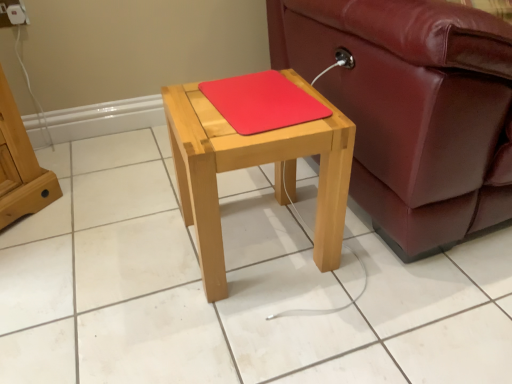
The width and height of the screenshot is (512, 384). Find the location of `unoccupied area in front of natural wood table at center`. unoccupied area in front of natural wood table at center is located at coordinates (264, 333).